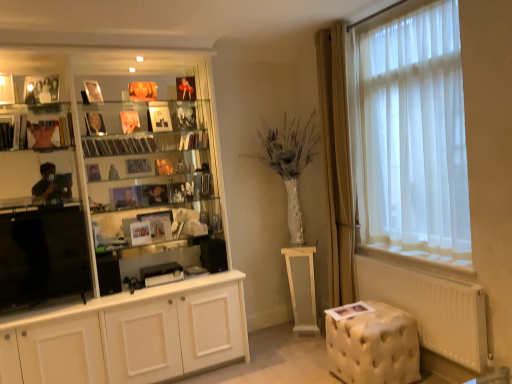
Question: In terms of width, does transparent plastic cds at center, which is the fourth book in right-to-left order, look wider or thinner when compared to matte glass shelf at left?

Choices:
 (A) wide
 (B) thin

Answer: (A)

Question: Is transparent plastic cds at center, the third book positioned from the bottom, taller or shorter than matte glass shelf at left?

Choices:
 (A) tall
 (B) short

Answer: (B)

Question: Which object is the farthest from the white glossy cupboard at left?

Choices:
 (A) tufted cream ottoman at lower right
 (B) hardcover book at center, acting as the 5th book starting from the bottom
 (C) white glossy pedestal at center
 (D) matte black bust at left, which appears as the fourth book when ordered from the bottom
 (E) metallic glass book at center, the 4th book positioned from the left

Answer: (A)

Question: Estimate the real-world distances between objects in this image. Which object is closer to the white glossy cupboard at left?

Choices:
 (A) matte glass shelf at left
 (B) white paper book at lower right, arranged as the 5th book when viewed from the top
 (C) metallic glass book at center, the second book positioned from the bottom
 (D) tufted cream ottoman at lower right
 (E) transparent plastic cds at center, which ranks as the third book in top-to-bottom order

Answer: (E)